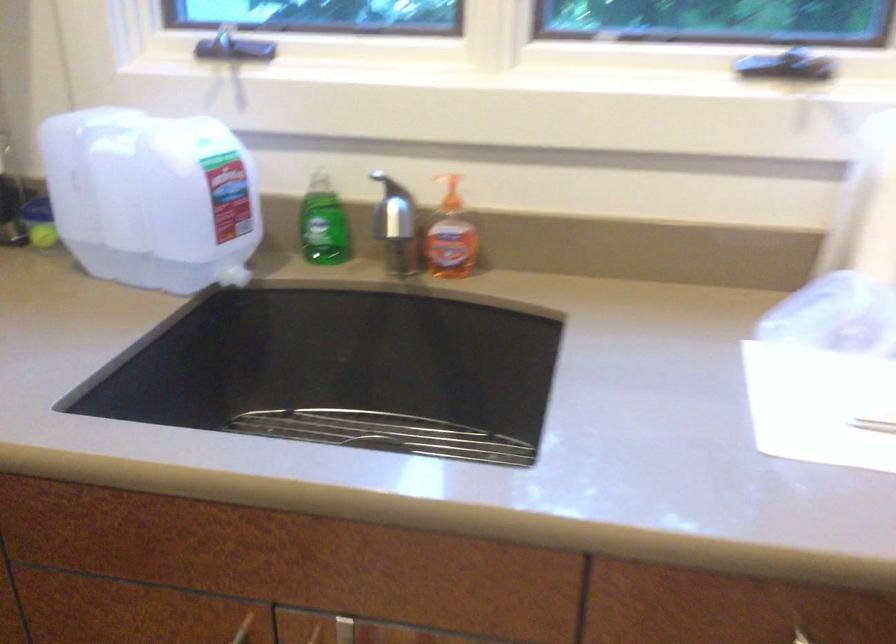
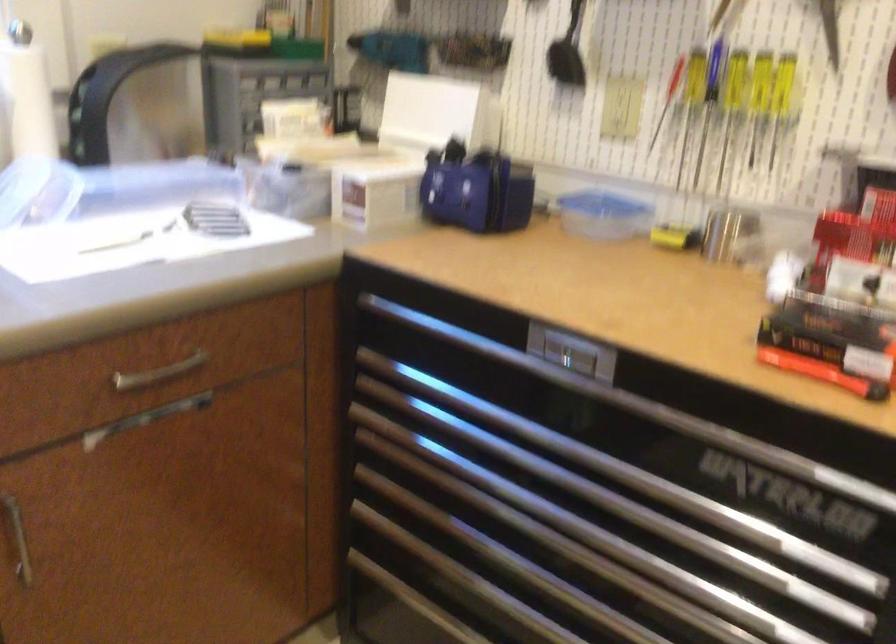
Question: The camera is either moving clockwise (left) or counter-clockwise (right) around the object. The first image is from the beginning of the video and the second image is from the end. Is the camera moving left or right when shooting the video?

Choices:
 (A) Left
 (B) Right

Answer: (A)